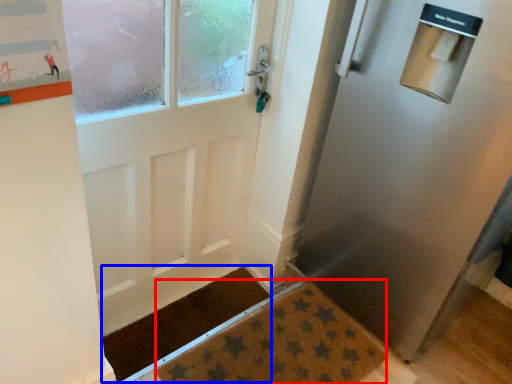
Question: Which object appears farthest to the camera in this image, doormat (highlighted by a red box) or doormat (highlighted by a blue box)?

Choices:
 (A) doormat
 (B) doormat

Answer: (B)